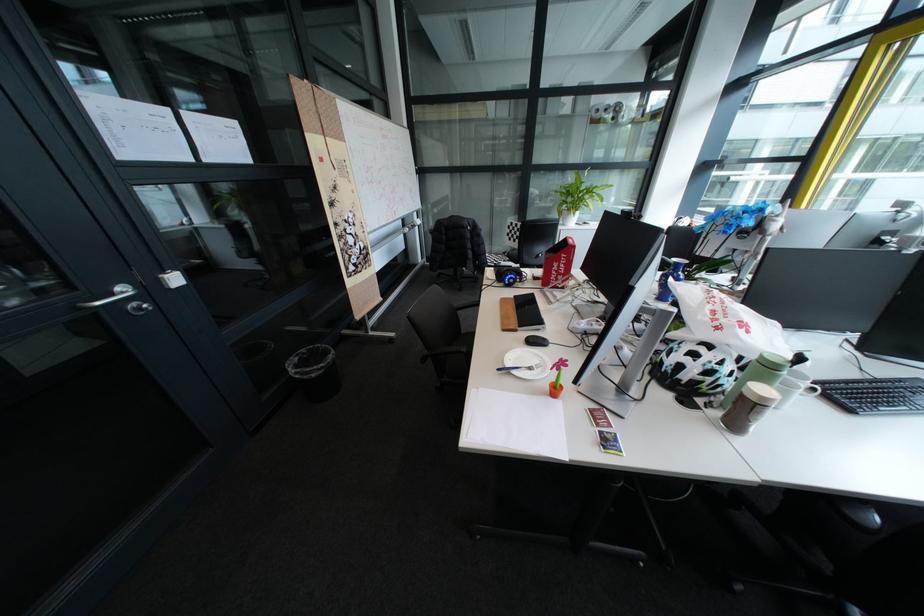
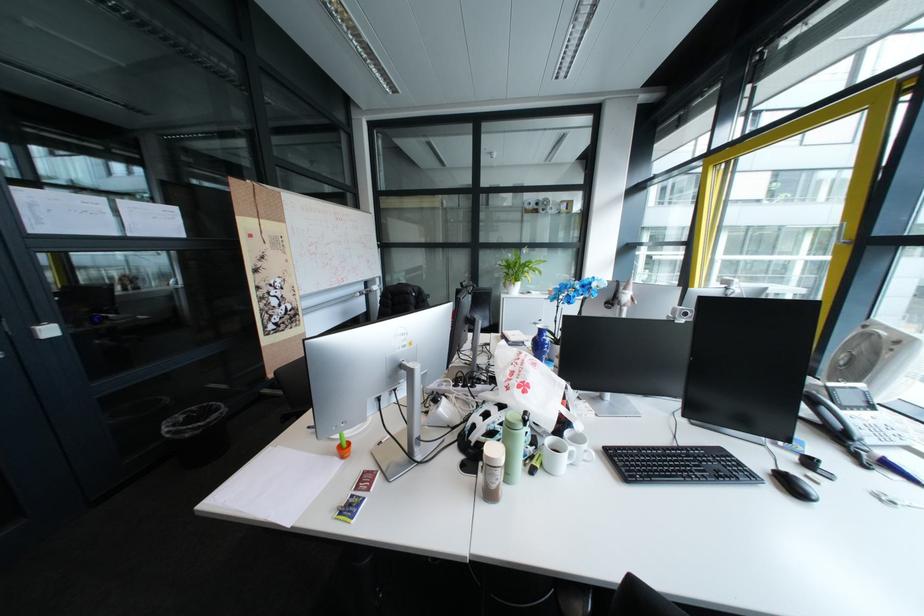
Locate, in the second image, the point that corresponds to the point at 709,361 in the first image.

(497, 421)